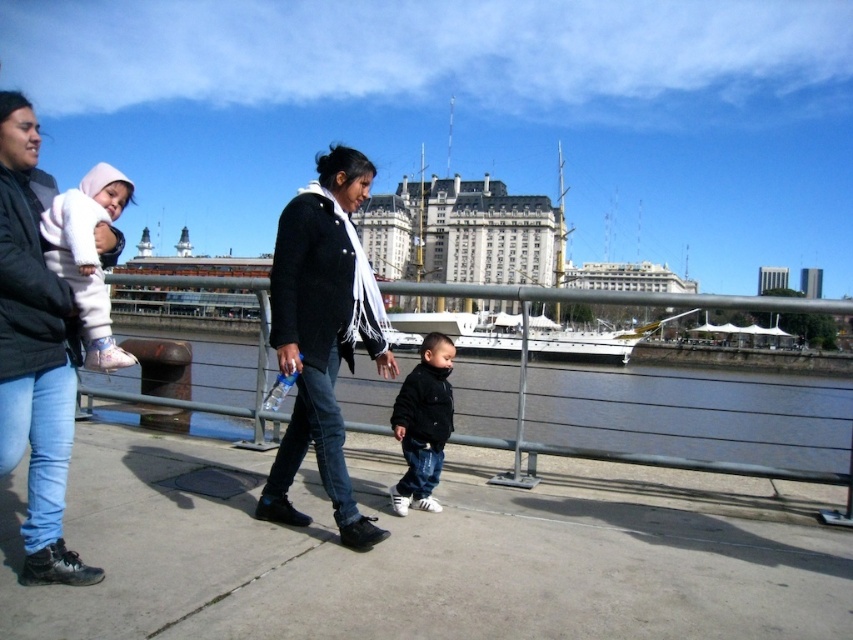
You are standing at the waterfront promenade and want to take a photo of the two points mentioned. Which point is closer to you, point (316,444) or point (39,241)?

Point (39,241) is closer to you because it is less further than point (316,444) which is further away.

You are a photographer trying to capture a shot of the white fleece jacket at upper left without including the historic building in the background. Based on its position, is it possible to frame the jacket in such a way?

The white fleece jacket at upper left is located at point (86, 257), which is positioned in the foreground away from the historic building, so yes, you can frame it without including the building.